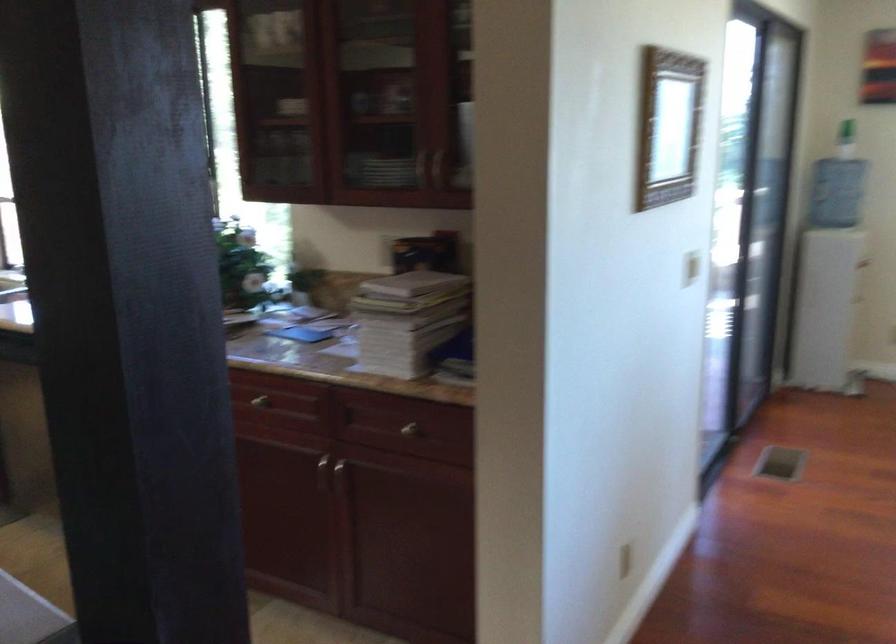
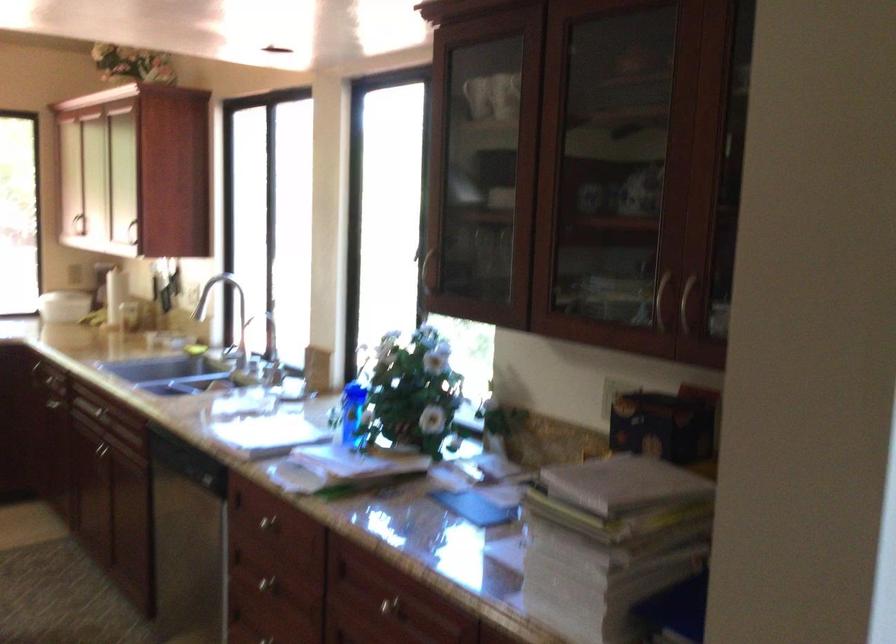
Question: The camera is either moving clockwise (left) or counter-clockwise (right) around the object. The first image is from the beginning of the video and the second image is from the end. Is the camera moving left or right when shooting the video?

Choices:
 (A) Left
 (B) Right

Answer: (B)